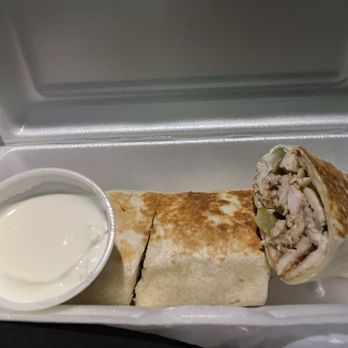
Where is `cup`? The width and height of the screenshot is (348, 348). cup is located at coordinates (97, 189).